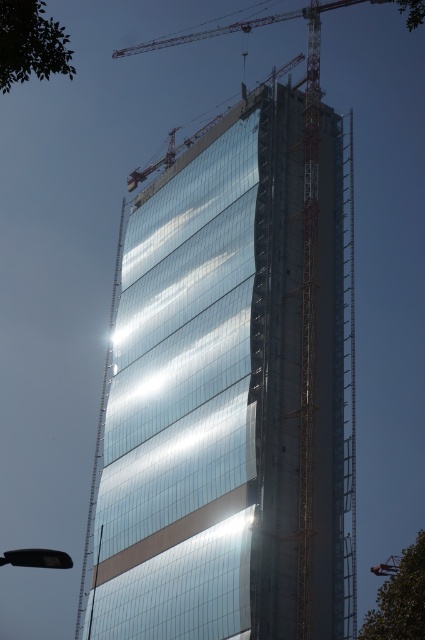
Question: Which point is farther to the camera?

Choices:
 (A) transparent glass building at center
 (B) metallic yellow crane at upper center

Answer: (B)

Question: Is transparent glass building at center further to camera compared to metallic yellow crane at upper center?

Choices:
 (A) yes
 (B) no

Answer: (B)

Question: Does transparent glass building at center appear on the left side of metallic yellow crane at upper center?

Choices:
 (A) yes
 (B) no

Answer: (A)

Question: Which point is farther from the camera taking this photo?

Choices:
 (A) (172, 156)
 (B) (297, 404)

Answer: (A)

Question: Does transparent glass building at center appear on the left side of metallic yellow crane at upper center?

Choices:
 (A) no
 (B) yes

Answer: (B)